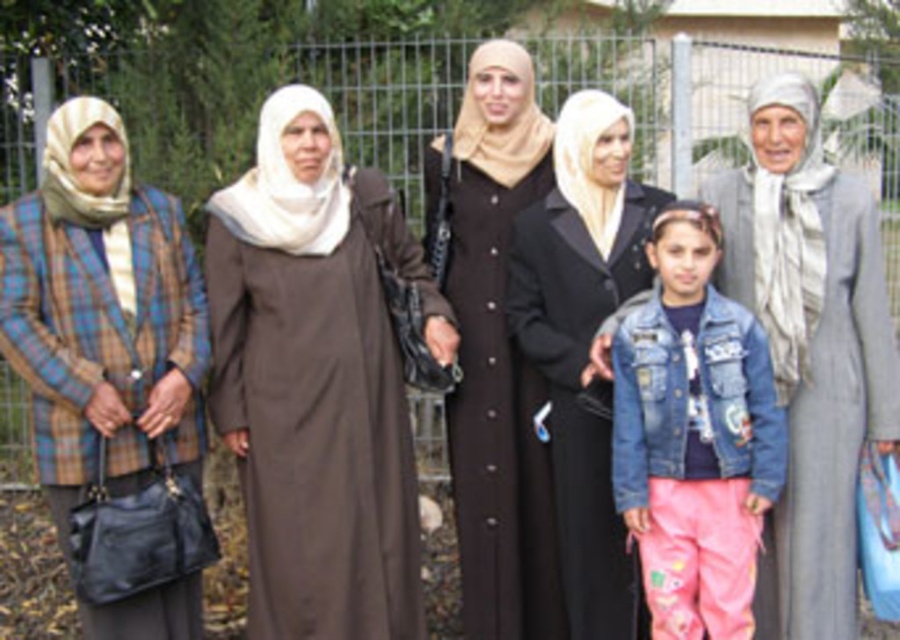
You are a photographer trying to capture a clear shot of the brown matte dress at center without the plaid fabric jacket at left blocking it. Based on their positions, is this possible?

The brown matte dress at center is positioned over the plaid fabric jacket at left, meaning the dress is in front of the jacket. Therefore, you can capture a clear shot of the brown matte dress at center without the plaid fabric jacket at left blocking it since the dress is closer to the camera.

In the scene shown: You are a photographer trying to capture a photo of the group. You want to ensure that both the gray woolen dress at right and the black matte dress at center are visible in the frame. Based on their positions, which dress should you focus on first to ensure both are in the shot?

You should focus on the black matte dress at center first because the gray woolen dress at right is to the right of it, so centering the black matte dress at center will help include both in the frame.

You are a photographer trying to capture the gray woolen dress at right and the black matte dress at center in the same frame. Based on their positions, which dress should you focus on first to ensure both are in the shot?

The gray woolen dress at right is located below the black matte dress at center. To capture both in the same frame, focus on the black matte dress at center first as it is higher up, then adjust the camera angle downward to include the gray woolen dress at right.